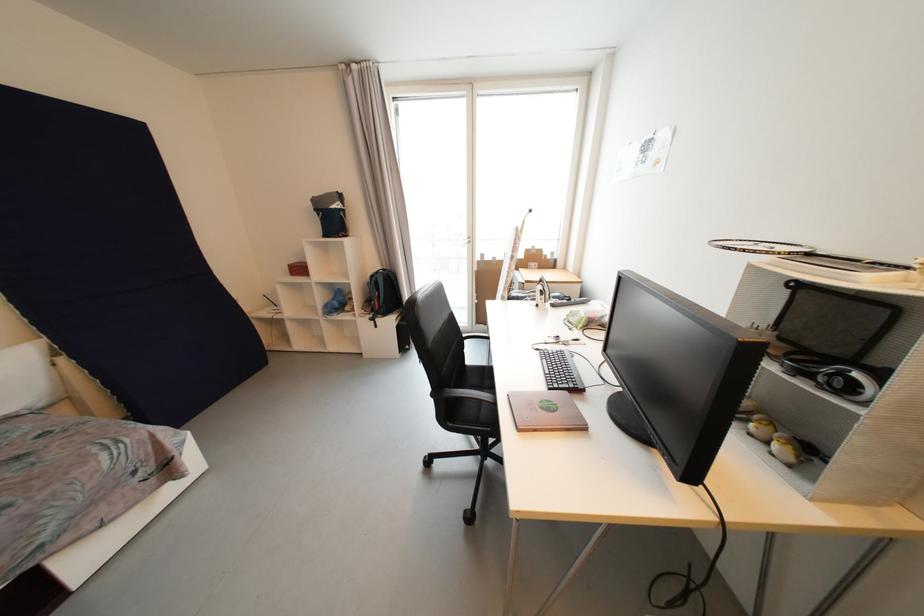
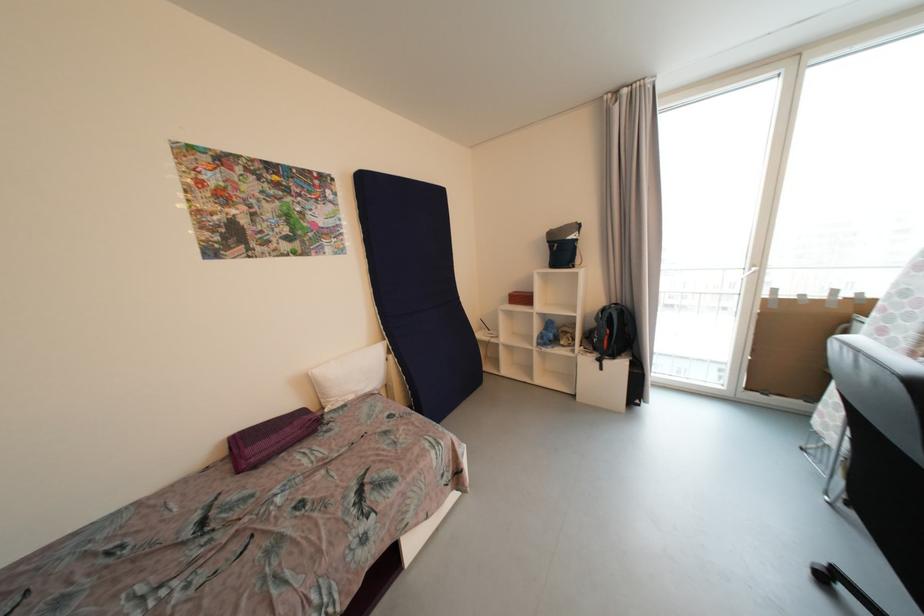
Question: The first image is from the beginning of the video and the second image is from the end. How did the camera likely rotate when shooting the video?

Choices:
 (A) Left
 (B) Right
 (C) Up
 (D) Down

Answer: (A)